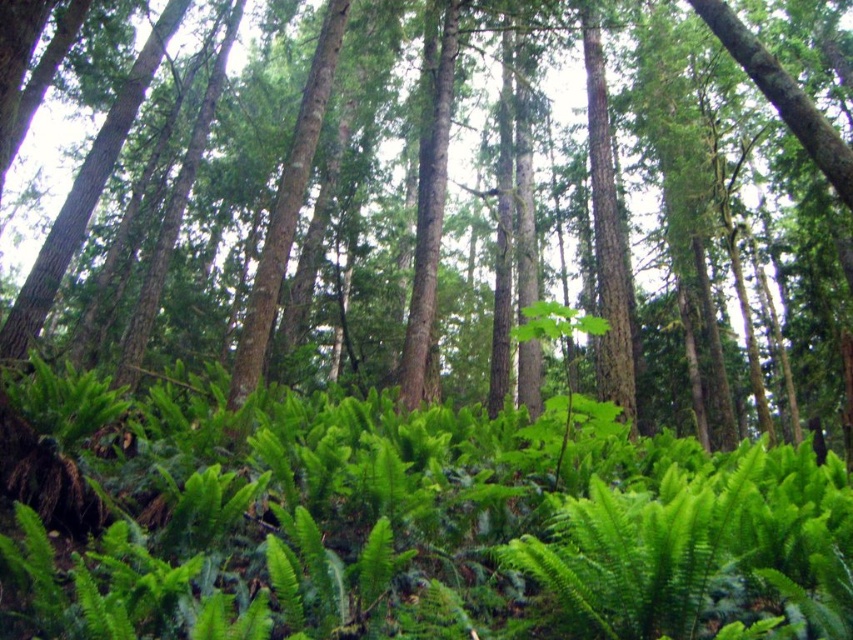
Question: Which point is farther to the camera?

Choices:
 (A) (465, 541)
 (B) (622, 314)

Answer: (B)

Question: Which point is closer to the camera?

Choices:
 (A) (345, 451)
 (B) (0, 192)

Answer: (A)

Question: Does green leafy fern at center appear on the right side of green leafy fern at lower center?

Choices:
 (A) no
 (B) yes

Answer: (B)

Question: Can you confirm if green leafy fern at center is positioned to the right of green leafy fern at lower center?

Choices:
 (A) yes
 (B) no

Answer: (A)

Question: Which point is farther from the camera taking this photo?

Choices:
 (A) pyautogui.click(x=368, y=480)
 (B) pyautogui.click(x=746, y=38)

Answer: (B)

Question: Considering the relative positions of green leafy fern at center and green leafy fern at lower center in the image provided, where is green leafy fern at center located with respect to green leafy fern at lower center?

Choices:
 (A) above
 (B) below

Answer: (B)